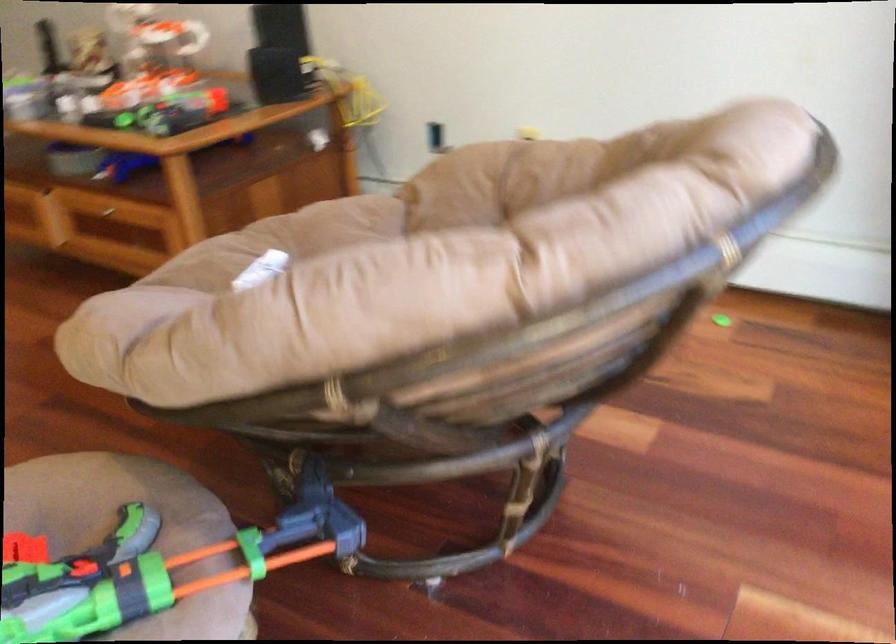
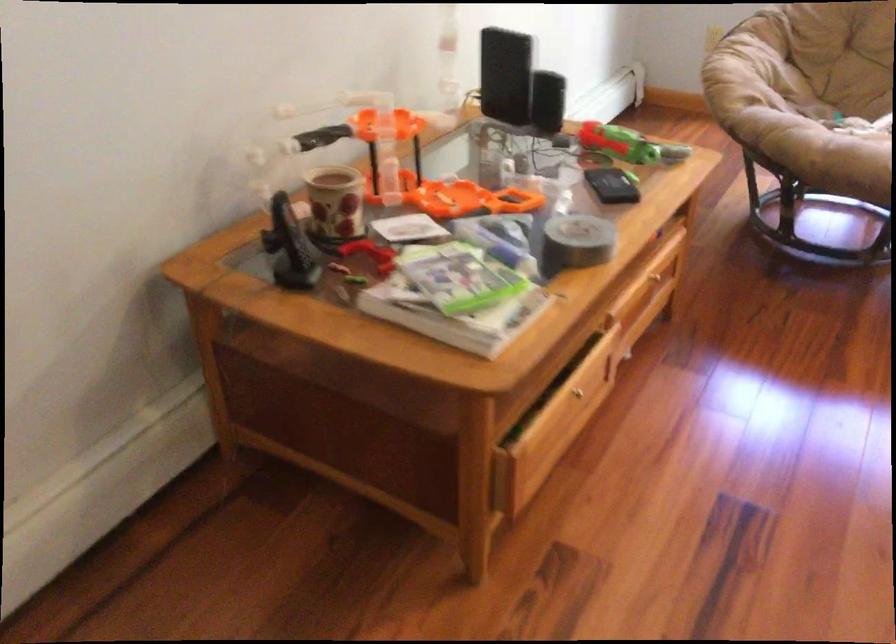
The point at (x=161, y=105) is marked in the first image. Where is the corresponding point in the second image?

(627, 145)